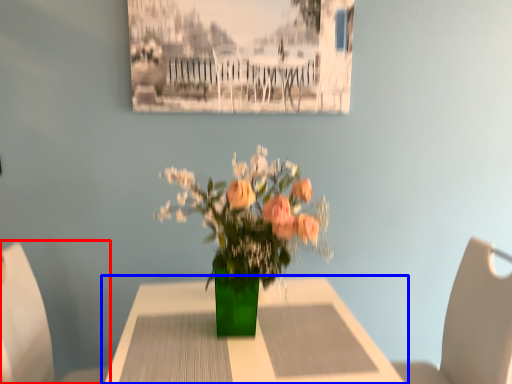
Question: Which of the following is the closest to the observer, chair (highlighted by a red box) or table (highlighted by a blue box)?

Choices:
 (A) chair
 (B) table

Answer: (B)